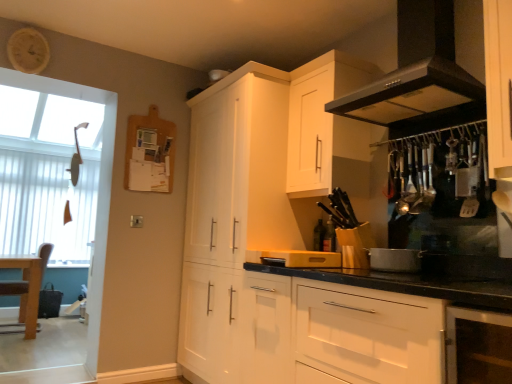
Question: Can you confirm if silver metallic pot at center, the 2th appliance in the left-to-right sequence, is smaller than black matte exhaust hood at upper right?

Choices:
 (A) yes
 (B) no

Answer: (A)

Question: Does silver metallic pot at center, positioned as the first appliance in right-to-left order, have a greater width compared to black matte exhaust hood at upper right?

Choices:
 (A) no
 (B) yes

Answer: (A)

Question: From the image's perspective, is silver metallic pot at center, the 2th appliance in the left-to-right sequence, under black matte exhaust hood at upper right?

Choices:
 (A) yes
 (B) no

Answer: (A)

Question: From the image's perspective, is silver metallic pot at center, the 2th appliance in the left-to-right sequence, on black matte exhaust hood at upper right?

Choices:
 (A) no
 (B) yes

Answer: (A)

Question: Can you confirm if silver metallic pot at center, positioned as the first appliance in right-to-left order, is taller than black matte exhaust hood at upper right?

Choices:
 (A) yes
 (B) no

Answer: (B)

Question: Looking at their shapes, would you say silver metallic pot at center, the 2th appliance in the left-to-right sequence, is wider or thinner than black matte exhaust hood at upper right?

Choices:
 (A) wide
 (B) thin

Answer: (B)

Question: Is point (393, 271) positioned closer to the camera than point (410, 3)?

Choices:
 (A) closer
 (B) farther

Answer: (A)

Question: Is silver metallic pot at center, the 2th appliance in the left-to-right sequence, taller or shorter than black matte exhaust hood at upper right?

Choices:
 (A) short
 (B) tall

Answer: (A)

Question: Considering the relative positions of silver metallic pot at center, positioned as the first appliance in right-to-left order, and black matte exhaust hood at upper right in the image provided, is silver metallic pot at center, positioned as the first appliance in right-to-left order, to the left or to the right of black matte exhaust hood at upper right?

Choices:
 (A) left
 (B) right

Answer: (A)

Question: Looking at their shapes, would you say black matte exhaust hood at upper right is wider or thinner than white vertical blinds at left?

Choices:
 (A) thin
 (B) wide

Answer: (B)

Question: Looking at the image, does black matte exhaust hood at upper right seem bigger or smaller compared to white vertical blinds at left?

Choices:
 (A) small
 (B) big

Answer: (B)

Question: In terms of height, does black matte exhaust hood at upper right look taller or shorter compared to white vertical blinds at left?

Choices:
 (A) tall
 (B) short

Answer: (B)

Question: From the image's perspective, is black matte exhaust hood at upper right positioned above or below white vertical blinds at left?

Choices:
 (A) below
 (B) above

Answer: (B)

Question: Would you say wooden tray at center, which is the 2th appliance from right to left, is to the left or to the right of white glossy cabinet at upper center, the first cabinetry in the back-to-front sequence, in the picture?

Choices:
 (A) left
 (B) right

Answer: (B)

Question: From a real-world perspective, relative to white glossy cabinet at upper center, the first cabinetry in the back-to-front sequence, is wooden tray at center, marked as the first appliance in a left-to-right arrangement, vertically above or below?

Choices:
 (A) above
 (B) below

Answer: (B)